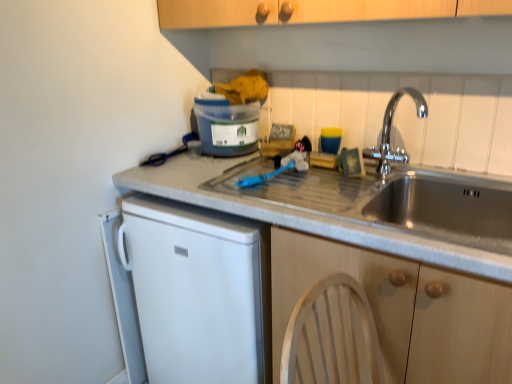
Question: Considering the relative positions of chrome metallic faucet at upper right and wooden cabinet at lower right in the image provided, is chrome metallic faucet at upper right in front of wooden cabinet at lower right?

Choices:
 (A) no
 (B) yes

Answer: (A)

Question: From a real-world perspective, is chrome metallic faucet at upper right under wooden cabinet at lower right?

Choices:
 (A) no
 (B) yes

Answer: (A)

Question: Is chrome metallic faucet at upper right positioned beyond the bounds of wooden cabinet at lower right?

Choices:
 (A) yes
 (B) no

Answer: (A)

Question: Considering the relative sizes of chrome metallic faucet at upper right and wooden cabinet at lower right in the image provided, is chrome metallic faucet at upper right taller than wooden cabinet at lower right?

Choices:
 (A) no
 (B) yes

Answer: (A)

Question: Does chrome metallic faucet at upper right have a smaller size compared to wooden cabinet at lower right?

Choices:
 (A) no
 (B) yes

Answer: (B)

Question: Is the position of chrome metallic faucet at upper right more distant than that of wooden cabinet at lower right?

Choices:
 (A) yes
 (B) no

Answer: (A)

Question: Does wooden cabinet at lower right have a larger size compared to chrome metallic faucet at upper right?

Choices:
 (A) yes
 (B) no

Answer: (A)

Question: Is wooden cabinet at lower right shorter than chrome metallic faucet at upper right?

Choices:
 (A) no
 (B) yes

Answer: (A)

Question: Considering the relative sizes of wooden cabinet at lower right and chrome metallic faucet at upper right in the image provided, is wooden cabinet at lower right thinner than chrome metallic faucet at upper right?

Choices:
 (A) yes
 (B) no

Answer: (B)

Question: Is wooden cabinet at lower right smaller than chrome metallic faucet at upper right?

Choices:
 (A) yes
 (B) no

Answer: (B)

Question: Is wooden cabinet at lower right facing away from chrome metallic faucet at upper right?

Choices:
 (A) no
 (B) yes

Answer: (A)

Question: From a real-world perspective, is wooden cabinet at lower right located higher than chrome metallic faucet at upper right?

Choices:
 (A) yes
 (B) no

Answer: (B)

Question: Does chrome metallic faucet at upper right have a lesser width compared to matte plastic container at upper center?

Choices:
 (A) yes
 (B) no

Answer: (A)